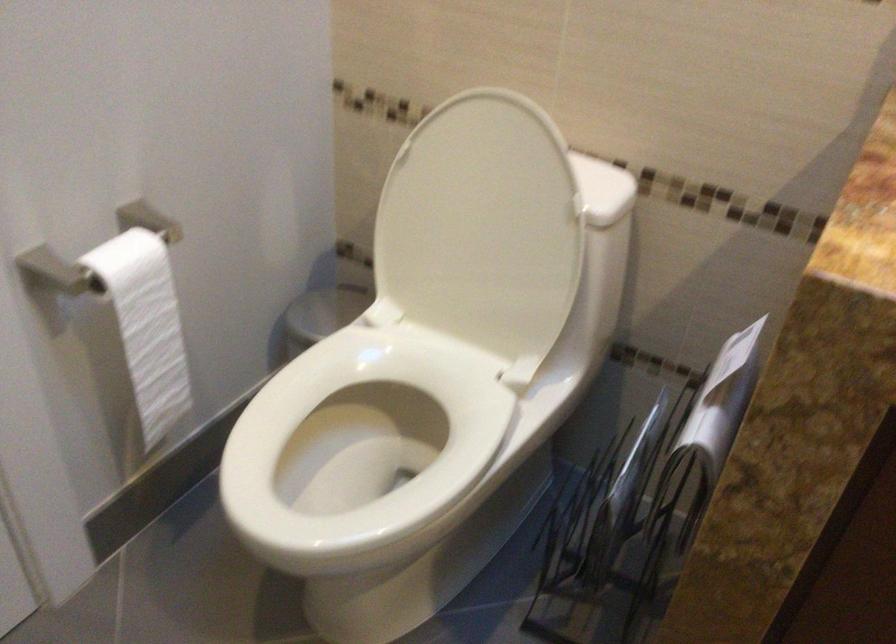
Identify the location of white toilet paper. (147, 325).